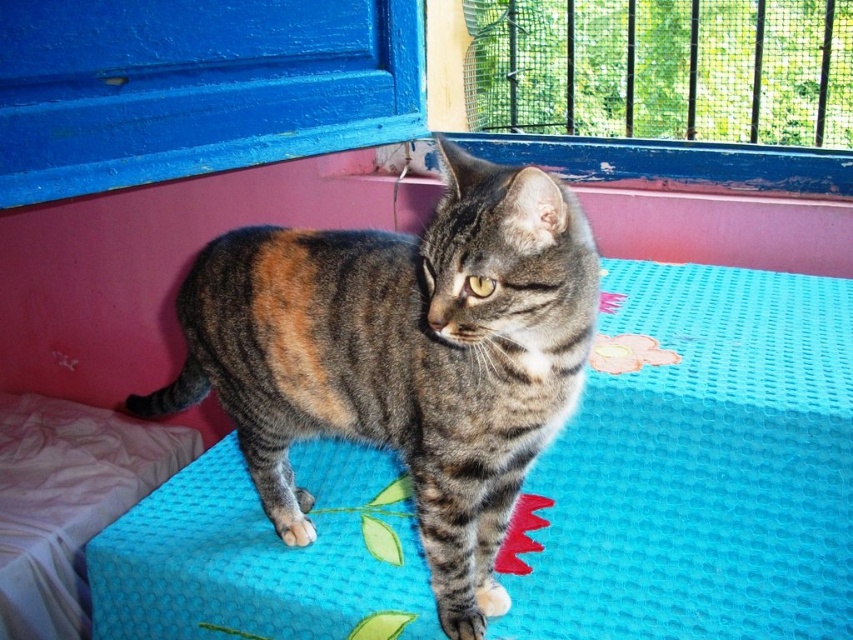
You are a photographer setting up a shoot. You have a tabby fur cat at center and a pink fabric at lower left in your frame. To ensure the cat is the main focus, where should you position the pink fabric relative to the cat?

The tabby fur cat at center is above the pink fabric at lower left, so positioning the pink fabric below the cat will keep the cat as the main focus in the frame.

You are a photographer setting up a shoot. You have a tabby fur cat at center and a pink fabric at lower left in your frame. You want to ensure the cat is the main focus. Based on their positions, which object is closer to the camera?

The tabby fur cat at center is closer to the camera because it is in front of the pink fabric at lower left.

You are an interior designer assessing the space in the image. You need to determine if the tabby fur cat at center can be moved to the area currently occupied by the pink fabric at lower left without overlapping. Based on their sizes, is this possible?

The tabby fur cat at center occupies less space than pink fabric at lower left, so yes, it can be moved there without overlapping.